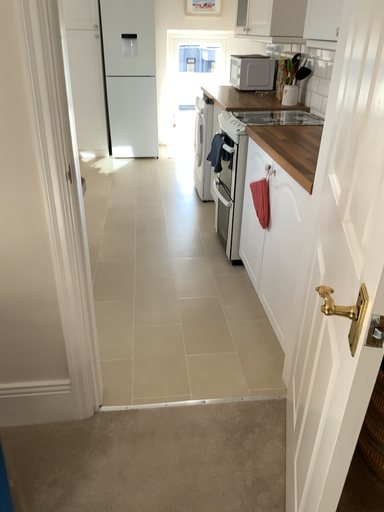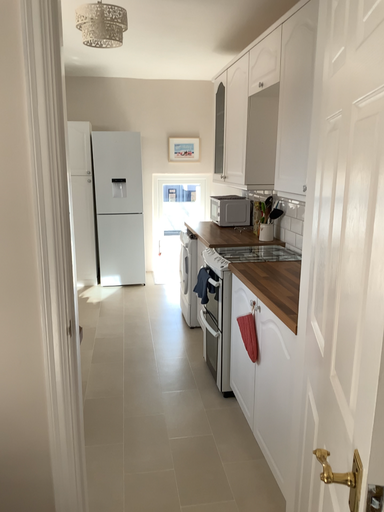
Question: Which way did the camera rotate in the video?

Choices:
 (A) rotated downward
 (B) rotated upward

Answer: (B)